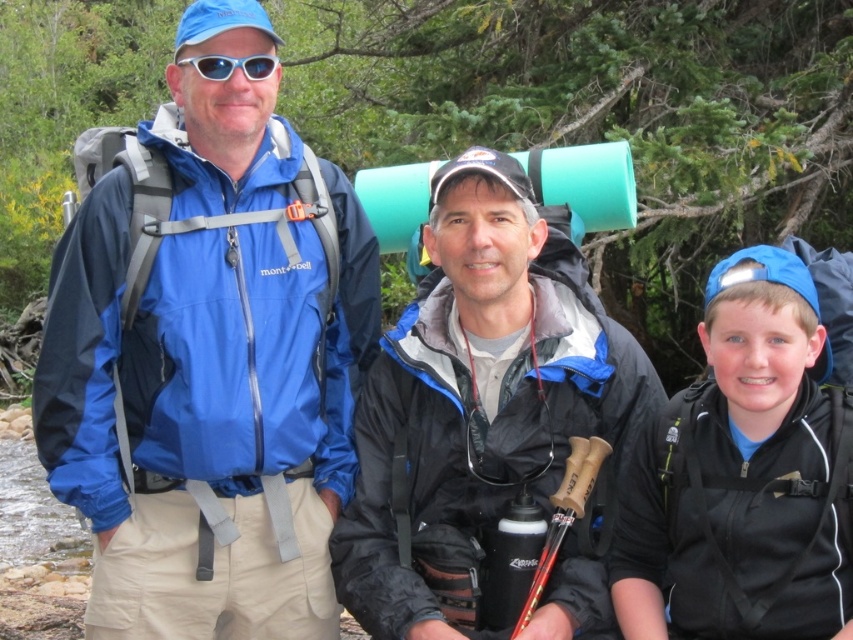
Question: Which object is positioned farthest from the white plastic goggles at upper center?

Choices:
 (A) blue fabric jacket at center
 (B) black matte jacket at right

Answer: (B)

Question: In this image, where is blue fabric jacket at center located relative to matte black jacket at center?

Choices:
 (A) right
 (B) left

Answer: (B)

Question: Is blue fabric jacket at center in front of white plastic goggles at upper center?

Choices:
 (A) yes
 (B) no

Answer: (A)

Question: Which is farther from the matte black jacket at center?

Choices:
 (A) blue fabric jacket at center
 (B) white plastic goggles at upper center

Answer: (B)

Question: Which object is closer to the camera taking this photo?

Choices:
 (A) white plastic goggles at upper center
 (B) matte black jacket at center

Answer: (B)

Question: Is matte black jacket at center closer to camera compared to black matte jacket at right?

Choices:
 (A) yes
 (B) no

Answer: (B)